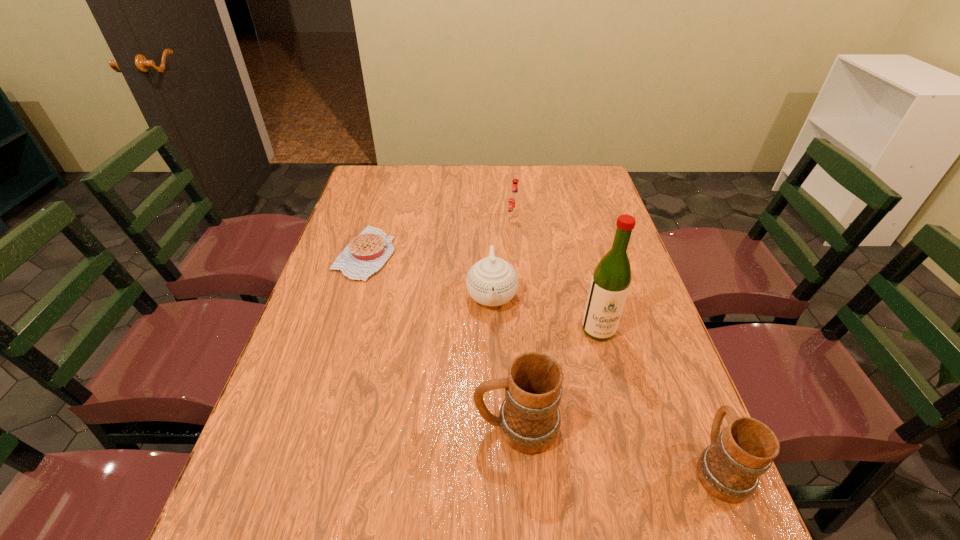
Please point out where to position a new mug on the left to maintain spacing. Please provide its 2D coordinates. Your answer should be formatted as a tuple, i.e. [(x, y)], where the tuple contains the x and y coordinates of a point satisfying the conditions above.

[(340, 393)]